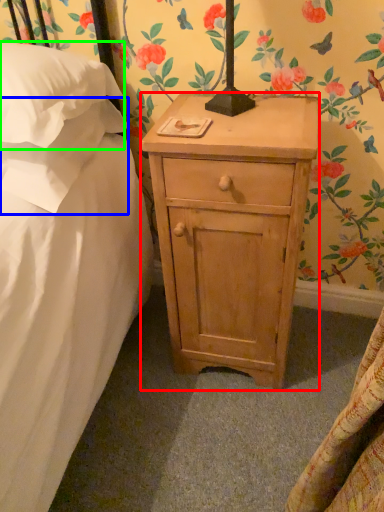
Question: Which object is positioned closest to nightstand (highlighted by a red box)? Select from pillow (highlighted by a blue box) and pillow (highlighted by a green box).

Choices:
 (A) pillow
 (B) pillow

Answer: (A)